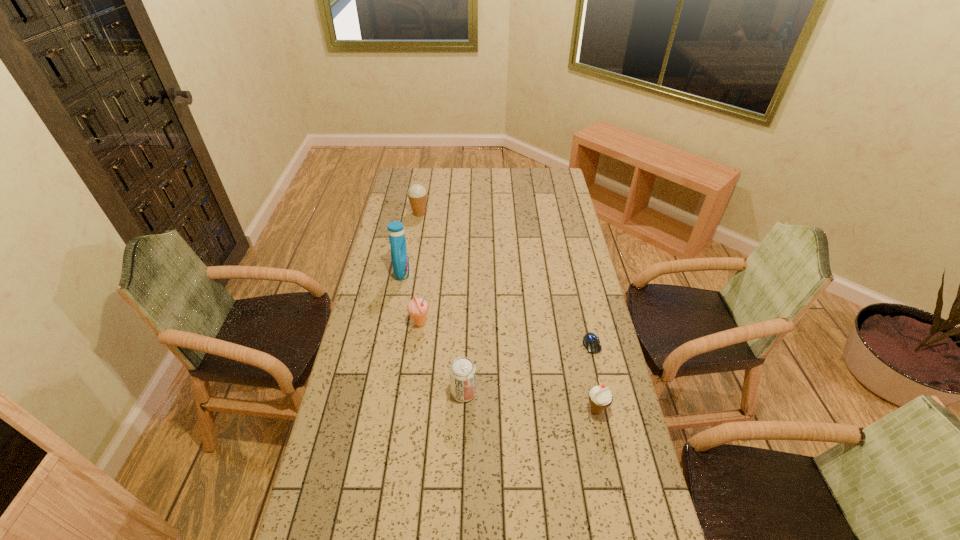
Image resolution: width=960 pixels, height=540 pixels. I want to click on free space between the nearest icecream and the farthest object, so click(x=508, y=312).

Select which object is the fourth closest to the second farthest icecream. Please provide its 2D coordinates. Your answer should be formatted as a tuple, i.e. [(x, y)], where the tuple contains the x and y coordinates of a point satisfying the conditions above.

[(600, 397)]

The height and width of the screenshot is (540, 960). Identify the location of object that is the fifth nearest to the nearest icecream. (417, 194).

Point out which icecream is positioned as the nearest to the computer mouse. Please provide its 2D coordinates. Your answer should be formatted as a tuple, i.e. [(x, y)], where the tuple contains the x and y coordinates of a point satisfying the conditions above.

[(600, 397)]

Image resolution: width=960 pixels, height=540 pixels. Identify the location of icecream that can be found as the second closest to the farthest object. [x=600, y=397].

You are a GUI agent. You are given a task and a screenshot of the screen. Output one action in this format:
    pyautogui.click(x=<x>, y=<y>)
    Task: Click on the blank area in the image that satisfies the following two spatial constraints: 1. on the back side of the soda can; 2. on the front-facing side of the detergent
    This screenshot has width=960, height=540.
    Given the screenshot: What is the action you would take?
    pyautogui.click(x=468, y=273)

The image size is (960, 540). I want to click on vacant region that satisfies the following two spatial constraints: 1. on the front-facing side of the second farthest object; 2. on the back side of the rightmost icecream, so click(376, 410).

Where is `vacant region that satisfies the following two spatial constraints: 1. on the front-facing side of the detergent; 2. on the back side of the third object from right to left`? The width and height of the screenshot is (960, 540). vacant region that satisfies the following two spatial constraints: 1. on the front-facing side of the detergent; 2. on the back side of the third object from right to left is located at coordinates (379, 393).